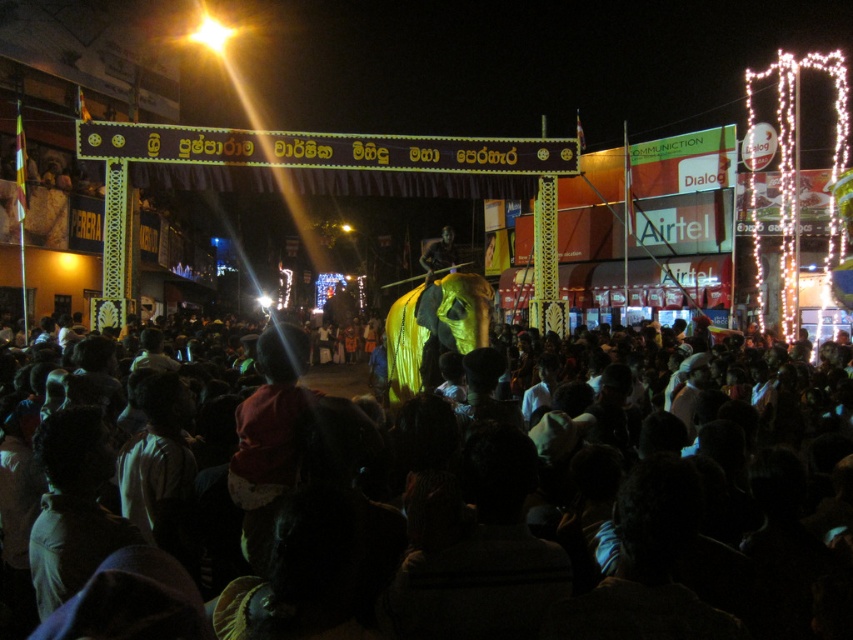
You are at the point marked as point (508, 541) in the image. What can you see right in front of you?

You can see dark brown hair at center right in front of you.